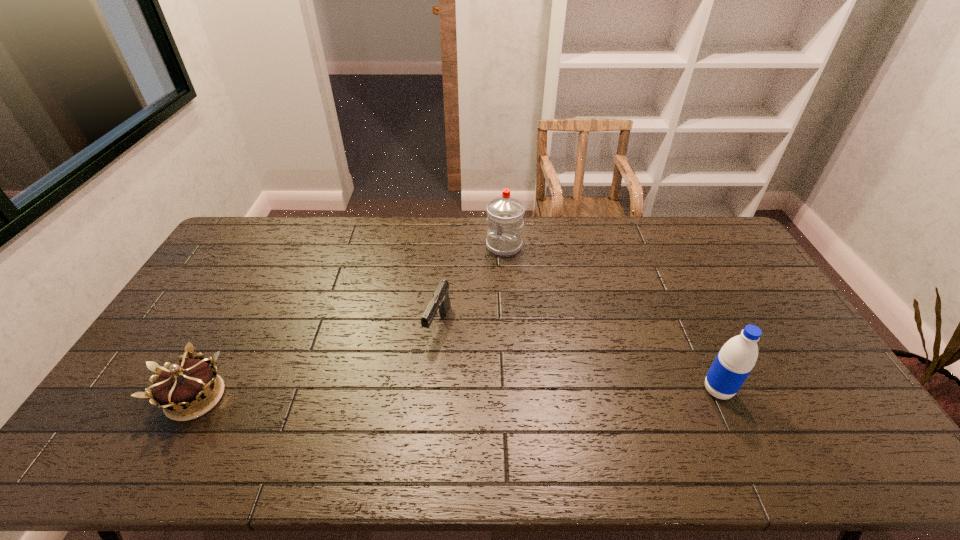
In order to click on vacant space on the desktop that is between the leftmost object and the right water bottle and is positioned aim along the barrel of the third nearest object in this screenshot , I will do pos(406,394).

Where is `free spot on the desktop that is between the crown and the right water bottle and is positioned on the handle side of the left water bottle`? free spot on the desktop that is between the crown and the right water bottle and is positioned on the handle side of the left water bottle is located at coordinates 409,394.